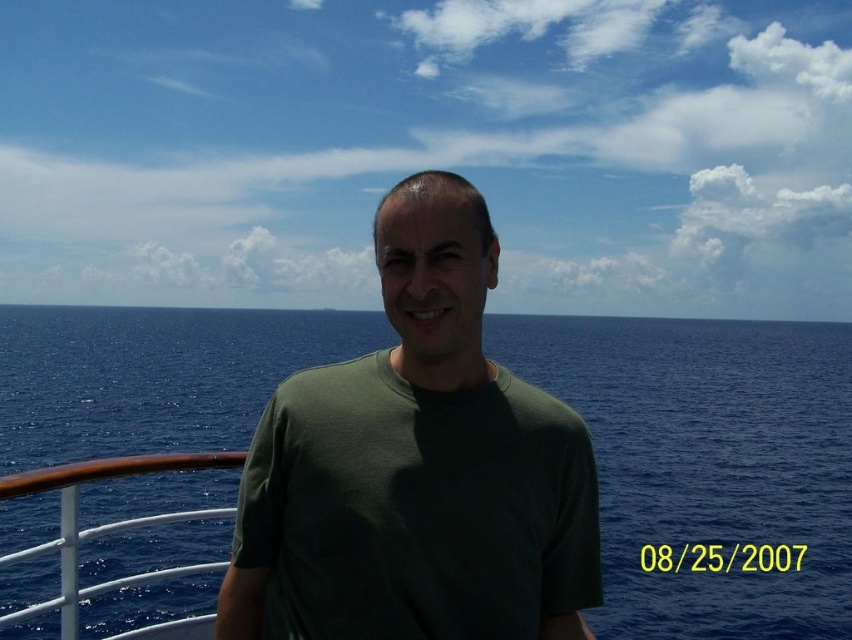
Does blue water at center have a larger size compared to dark green t-shirt at center?

Yes, blue water at center is bigger than dark green t-shirt at center.

Which is behind, point (707, 372) or point (507, 620)?

The point (707, 372) is more distant.

Measure the distance between point (x=655, y=436) and camera.

69.84 meters

You are a GUI agent. You are given a task and a screenshot of the screen. Output one action in this format:
    pyautogui.click(x=<x>, y=<y>)
    Task: Click on the blue water at center
    The width and height of the screenshot is (852, 640).
    Given the screenshot: What is the action you would take?
    pyautogui.click(x=707, y=465)